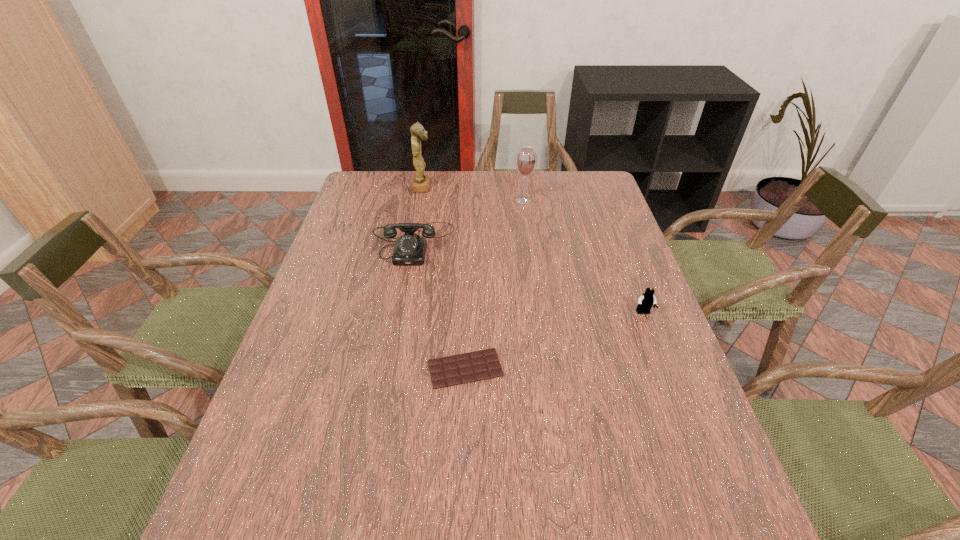
In order to click on free spot between the wineglass and the rightmost object in this screenshot , I will do `click(584, 256)`.

Where is `vacant area that lies between the fourth shortest object and the rightmost object`? vacant area that lies between the fourth shortest object and the rightmost object is located at coordinates (584, 256).

Locate an element on the screen. free space between the nearest object and the fourth farthest object is located at coordinates (554, 341).

Identify the location of free space between the Lego and the telephone. (529, 278).

In order to click on object that is the closest to the third farthest object in this screenshot , I will do `click(421, 182)`.

I want to click on object that ranks as the fourth closest to the Lego, so click(421, 182).

Identify the location of vacant position in the image that satisfies the following two spatial constraints: 1. on the front-facing side of the chocolate bar; 2. on the right side of the third nearest object. This screenshot has height=540, width=960. (392, 368).

Identify the location of vacant area in the image that satisfies the following two spatial constraints: 1. on the front-facing side of the telephone; 2. on the right side of the shortest object. The height and width of the screenshot is (540, 960). (392, 368).

Find the location of `free space that satisfies the following two spatial constraints: 1. on the front-facing side of the figurine; 2. on the left side of the second tallest object`. free space that satisfies the following two spatial constraints: 1. on the front-facing side of the figurine; 2. on the left side of the second tallest object is located at coordinates (420, 200).

The height and width of the screenshot is (540, 960). What are the coordinates of `free space in the image that satisfies the following two spatial constraints: 1. on the front-facing side of the fourth nearest object; 2. on the left side of the figurine` in the screenshot? It's located at (420, 200).